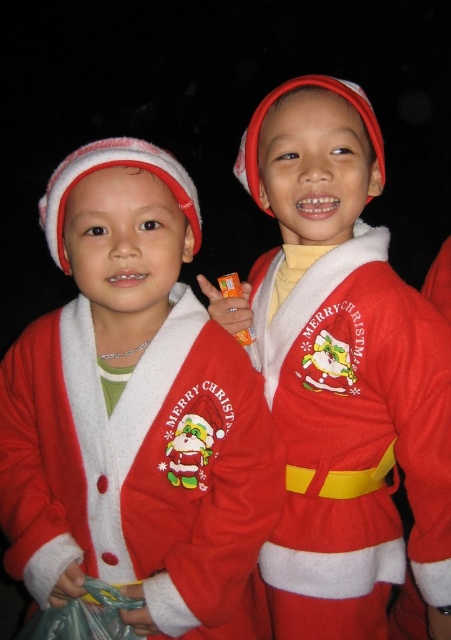
You are a photographer trying to capture a clear photo of the fuzzy red santa coat at center and the fuzzy red santa costume at center. Since both are fuzzy and red, which one will appear closer to the camera in the final photo?

The fuzzy red santa coat at center will appear closer to the camera because it is positioned in front of the fuzzy red santa costume at center.

You are taking a photo of two children in Santa suits. You notice two points marked in the image. Which point is closer to your camera lens, point 1 at coordinates [184,593] or point 2 at [316,332]?

Point 1 at coordinates [184,593] is closer to the camera lens than point 2 at [316,332].

You are a photographer taking a picture of two children in Santa outfits. You need to ensure that both the fuzzy red santa coat at center and the fuzzy red santa costume at center are clearly visible. Which one should you focus on to make sure it doesn

The fuzzy red santa coat at center is smaller than the fuzzy red santa costume at center, so you should focus on the fuzzy red santa costume at center to ensure it is clearly visible.